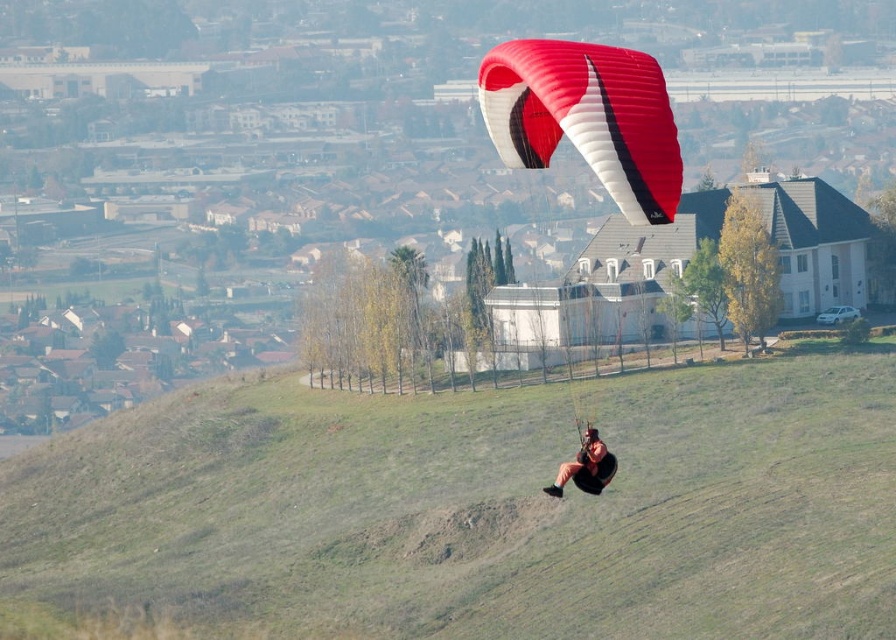
You are navigating a drone from the paraglider to a specific point. The paraglider is at point [537,152] and the target point is [584,492]. Which direction should you move the drone to reach the target point?

To reach the target point [584,492] from the paraglider at point [537,152], you should move the drone towards the right and slightly forward since point [537,152] is behind point [584,492].

Based on the coordinates provided, what object is located at point [586,116] in the image?

The red and white parachute at center is located at point [586,116].